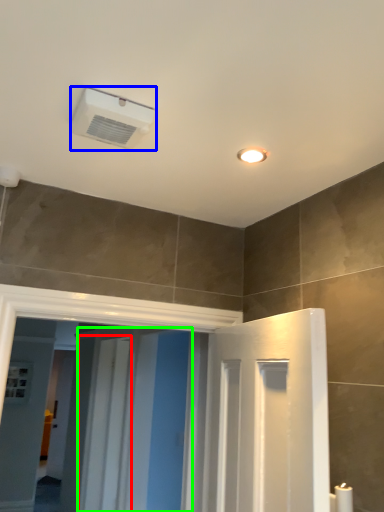
Question: Estimate the real-world distances between objects in this image. Which object is closer to screen door (highlighted by a red box), air conditioning (highlighted by a blue box) or screen door (highlighted by a green box)?

Choices:
 (A) air conditioning
 (B) screen door

Answer: (B)